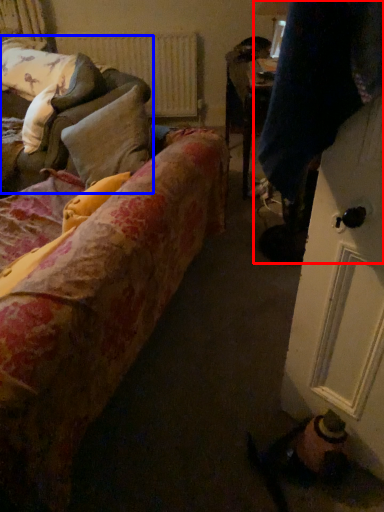
Question: Among these objects, which one is nearest to the camera, couple (highlighted by a red box) or studio couch (highlighted by a blue box)?

Choices:
 (A) couple
 (B) studio couch

Answer: (A)